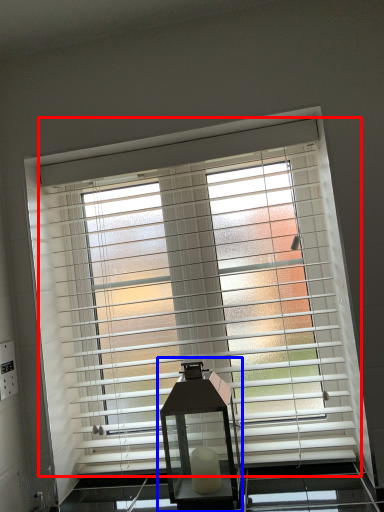
Question: Which of the following is the farthest to the observer, window blind (highlighted by a red box) or table lamp (highlighted by a blue box)?

Choices:
 (A) window blind
 (B) table lamp

Answer: (A)